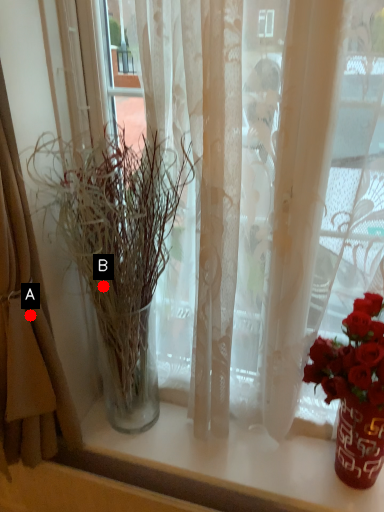
Question: Two points are circled on the image, labeled by A and B beside each circle. Among these points, which one is nearest to the camera?

Choices:
 (A) A is closer
 (B) B is closer

Answer: (A)